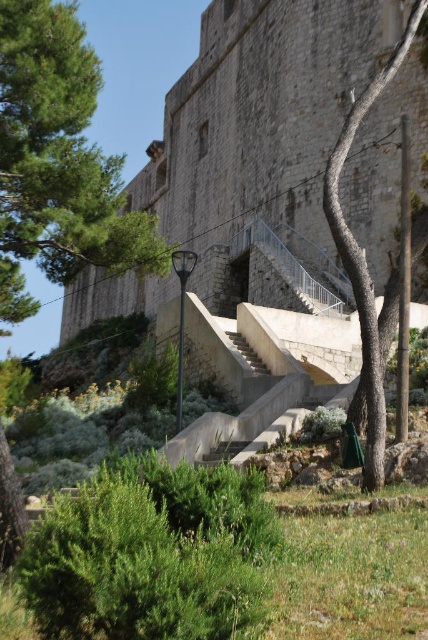
You are standing at the base of the stone wall at center and want to reach the green leafy tree at center. Which direction should you move to get closer to the tree?

You should move to the right because the stone wall at center is to the left of the green leafy tree at center, so moving right would bring you closer to the tree.

You are a hiker who wants to take a photo of the stone wall at center and the green leafy tree at center from a position where both are visible in the frame. Based on their positions, which object should you place closer to the bottom of the photo?

The green leafy tree at center should be placed closer to the bottom of the photo because the stone wall at center is above it.

You are a painter who needs to set up an easel. You have two options for placement near the stone wall at center and the smooth concrete stairs at center. Which location would allow you to place your easel closer to the edge of the structure without blocking the stairway?

The stone wall at center is wider than the smooth concrete stairs at center, so placing the easel near the stone wall at center would provide more space near the edge without obstructing the stairway.